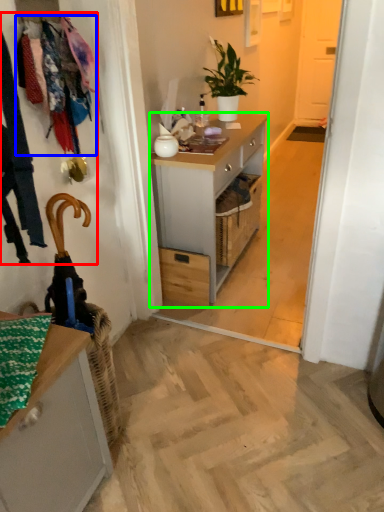
Question: Based on their relative distances, which object is farther from laundry (highlighted by a red box)? Choose from clothesline (highlighted by a blue box) and desk (highlighted by a green box).

Choices:
 (A) clothesline
 (B) desk

Answer: (B)